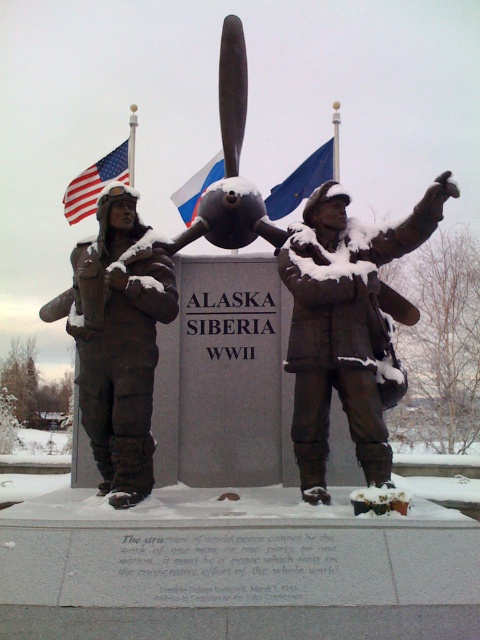
Question: Which is farther from the bronze statue at right?

Choices:
 (A) american flag at upper left
 (B) blue fabric flag at upper center
 (C) black matte propeller at center

Answer: (A)

Question: Which of the following is the farthest from the observer?

Choices:
 (A) bronze statue at right
 (B) blue fabric flag at center
 (C) american flag at upper left

Answer: (C)

Question: Can you confirm if bronze statue at right is thinner than blue fabric flag at upper center?

Choices:
 (A) yes
 (B) no

Answer: (A)

Question: Which of the following is the closest to the observer?

Choices:
 (A) (294, 205)
 (B) (383, 365)
 (C) (74, 193)
 (D) (252, 212)

Answer: (B)

Question: Considering the relative positions of bronze statue of soldier at left and blue fabric flag at center in the image provided, where is bronze statue of soldier at left located with respect to blue fabric flag at center?

Choices:
 (A) right
 (B) left

Answer: (A)

Question: Considering the relative positions of black matte propeller at center and american flag at upper left in the image provided, where is black matte propeller at center located with respect to american flag at upper left?

Choices:
 (A) left
 (B) right

Answer: (B)